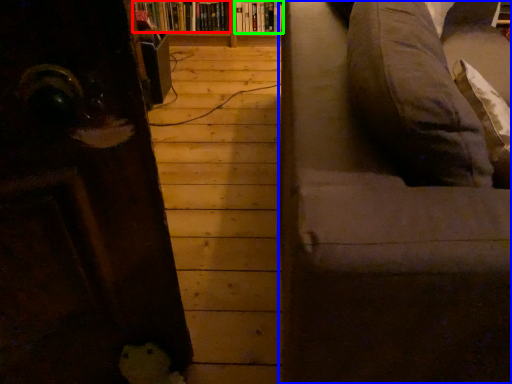
Question: Which object is the farthest from book (highlighted by a red box)? Choose among these: studio couch (highlighted by a blue box) or book (highlighted by a green box).

Choices:
 (A) studio couch
 (B) book

Answer: (A)